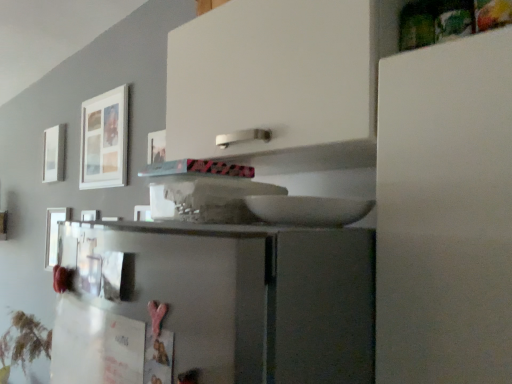
Image resolution: width=512 pixels, height=384 pixels. Find the location of `white matte picture frame at upper left, the third picture frame from the back`. white matte picture frame at upper left, the third picture frame from the back is located at coordinates [104, 139].

What are the coordinates of `picture frame on the left side of metallic silver picture frame at left, which is counted as the second picture frame, starting from the back` in the screenshot? It's located at (54, 153).

Does white matte picture frame at upper left, arranged as the 3th picture frame when viewed from the right, appear on the right side of metallic silver picture frame at left, the second picture frame positioned from the front?

In fact, white matte picture frame at upper left, arranged as the 3th picture frame when viewed from the right, is to the left of metallic silver picture frame at left, the second picture frame positioned from the front.

From a real-world perspective, is white matte picture frame at upper left, the first picture frame from the back, beneath metallic silver picture frame at left, which is counted as the second picture frame, starting from the back?

No, from a real-world perspective, white matte picture frame at upper left, the first picture frame from the back, is not beneath metallic silver picture frame at left, which is counted as the second picture frame, starting from the back.

Does white matte picture frame at upper left, the third picture frame from the front, turn towards metallic silver picture frame at left, which is counted as the second picture frame, starting from the back?

No, white matte picture frame at upper left, the third picture frame from the front, is not oriented towards metallic silver picture frame at left, which is counted as the second picture frame, starting from the back.

Is white matte picture frame at upper left, the first picture frame from the back, not close to white matte picture frame at upper left, which is counted as the 1th picture frame, starting from the right?

Answer: No, white matte picture frame at upper left, the first picture frame from the back, is not far away from white matte picture frame at upper left, which is counted as the 1th picture frame, starting from the right.

Between point (48, 135) and point (127, 129), which one is positioned behind?

The point (48, 135) is behind.

How many degrees apart are the facing directions of white matte picture frame at upper left, placed as the 1th picture frame when sorted from left to right, and white matte picture frame at upper left, the third picture frame from the back?

There is a 0.676-degree angle between the facing directions of white matte picture frame at upper left, placed as the 1th picture frame when sorted from left to right, and white matte picture frame at upper left, the third picture frame from the back.

Is white matte picture frame at upper left, the first picture frame from the back, behind white matte picture frame at upper left, which is the first picture frame from front to back?

Yes, white matte picture frame at upper left, the first picture frame from the back, is behind white matte picture frame at upper left, which is the first picture frame from front to back.

From the picture: Between white matte picture frame at upper left, the third picture frame from the back, and metallic silver picture frame at left, the second picture frame positioned from the front, which one is positioned in front?

white matte picture frame at upper left, the third picture frame from the back, is more forward.

I want to click on the 1st picture frame counting from the left of the white matte picture frame at upper left, the third picture frame from the back, so click(54, 234).

From a real-world perspective, between white matte picture frame at upper left, the third picture frame from the back, and metallic silver picture frame at left, the second picture frame positioned from the front, who is vertically lower?

metallic silver picture frame at left, the second picture frame positioned from the front, from a real-world perspective.

Which object is positioned more to the left, white matte picture frame at upper left, which is the first picture frame from front to back, or metallic silver picture frame at left, the second picture frame in the right-to-left sequence?

metallic silver picture frame at left, the second picture frame in the right-to-left sequence, is more to the left.

Considering the sizes of white matte picture frame at upper left, which is counted as the 1th picture frame, starting from the right, and white matte picture frame at upper left, placed as the 1th picture frame when sorted from left to right, in the image, is white matte picture frame at upper left, which is counted as the 1th picture frame, starting from the right, taller or shorter than white matte picture frame at upper left, placed as the 1th picture frame when sorted from left to right,?

Considering their sizes, white matte picture frame at upper left, which is counted as the 1th picture frame, starting from the right, has more height than white matte picture frame at upper left, placed as the 1th picture frame when sorted from left to right.

Can you confirm if white matte picture frame at upper left, which is counted as the 1th picture frame, starting from the right, is positioned to the left of white matte picture frame at upper left, the first picture frame from the back?

No, white matte picture frame at upper left, which is counted as the 1th picture frame, starting from the right, is not to the left of white matte picture frame at upper left, the first picture frame from the back.

Does white matte picture frame at upper left, which is the first picture frame from front to back, come behind white matte picture frame at upper left, the first picture frame from the back?

No.

From the image's perspective, between white matte picture frame at upper left, the third picture frame from the back, and white matte picture frame at upper left, the first picture frame from the back, which one is located above?

white matte picture frame at upper left, the third picture frame from the back.

Between metallic silver picture frame at left, the second picture frame in the right-to-left sequence, and white matte picture frame at upper left, which is counted as the 1th picture frame, starting from the right, which one has larger width?

Wider between the two is metallic silver picture frame at left, the second picture frame in the right-to-left sequence.

Is metallic silver picture frame at left, which is counted as the second picture frame, starting from the back, to the right of white matte picture frame at upper left, which is the first picture frame from front to back, from the viewer's perspective?

Incorrect, metallic silver picture frame at left, which is counted as the second picture frame, starting from the back, is not on the right side of white matte picture frame at upper left, which is the first picture frame from front to back.

In the scene shown: Would you say metallic silver picture frame at left, acting as the 2th picture frame starting from the left, is a long distance from white matte picture frame at upper left, which is the first picture frame from front to back?

That's not correct — metallic silver picture frame at left, acting as the 2th picture frame starting from the left, is a little close to white matte picture frame at upper left, which is the first picture frame from front to back.

Where is `picture frame that is the 2nd object located below the white matte picture frame at upper left, which is the third picture frame in left-to-right order (from the image's perspective)`? picture frame that is the 2nd object located below the white matte picture frame at upper left, which is the third picture frame in left-to-right order (from the image's perspective) is located at coordinates (54, 234).

Based on the photo, is metallic silver picture frame at left, the second picture frame positioned from the front, wider than white matte picture frame at upper left, the first picture frame from the back?

No.

Which is behind, metallic silver picture frame at left, the second picture frame in the right-to-left sequence, or white matte picture frame at upper left, placed as the 1th picture frame when sorted from left to right?

white matte picture frame at upper left, placed as the 1th picture frame when sorted from left to right, is further away from the camera.

Which of these two, metallic silver picture frame at left, the second picture frame positioned from the front, or white matte picture frame at upper left, the first picture frame from the back, is smaller?

metallic silver picture frame at left, the second picture frame positioned from the front.

Is metallic silver picture frame at left, the second picture frame in the right-to-left sequence, not inside white matte picture frame at upper left, placed as the 1th picture frame when sorted from left to right?

metallic silver picture frame at left, the second picture frame in the right-to-left sequence, is positioned outside white matte picture frame at upper left, placed as the 1th picture frame when sorted from left to right.

Identify the location of picture frame lying below the white matte picture frame at upper left, the third picture frame from the front (from the image's perspective). (54, 234).

Starting from the white matte picture frame at upper left, the first picture frame from the back, which picture frame is the 2nd one to the right? Please provide its 2D coordinates.

[(104, 139)]

Which object lies further to the anchor point white matte picture frame at upper left, which is the third picture frame in left-to-right order, white matte picture frame at upper left, the third picture frame from the front, or metallic silver picture frame at left, acting as the 2th picture frame starting from the left?

white matte picture frame at upper left, the third picture frame from the front, is positioned further to the anchor white matte picture frame at upper left, which is the third picture frame in left-to-right order.

Considering their positions, is white matte picture frame at upper left, which is the first picture frame from front to back, positioned further to metallic silver picture frame at left, the second picture frame positioned from the front, than white matte picture frame at upper left, placed as the 1th picture frame when sorted from left to right?

white matte picture frame at upper left, which is the first picture frame from front to back.

Looking at the image, which one is located closer to white matte picture frame at upper left, which is the third picture frame in left-to-right order, metallic silver picture frame at left, the second picture frame in the right-to-left sequence, or white matte picture frame at upper left, arranged as the 3th picture frame when viewed from the right?

metallic silver picture frame at left, the second picture frame in the right-to-left sequence, lies closer to white matte picture frame at upper left, which is the third picture frame in left-to-right order, than the other object.

Which object lies nearer to the anchor point metallic silver picture frame at left, acting as the 2th picture frame starting from the left, white matte picture frame at upper left, the first picture frame from the back, or white matte picture frame at upper left, the third picture frame from the back?

The object closer to metallic silver picture frame at left, acting as the 2th picture frame starting from the left, is white matte picture frame at upper left, the first picture frame from the back.

Based on their spatial positions, is white matte picture frame at upper left, which is counted as the 1th picture frame, starting from the right, or metallic silver picture frame at left, the second picture frame in the right-to-left sequence, closer to white matte picture frame at upper left, placed as the 1th picture frame when sorted from left to right?

Among the two, metallic silver picture frame at left, the second picture frame in the right-to-left sequence, is located nearer to white matte picture frame at upper left, placed as the 1th picture frame when sorted from left to right.

Based on their spatial positions, is metallic silver picture frame at left, acting as the 2th picture frame starting from the left, or white matte picture frame at upper left, the third picture frame from the back, further from white matte picture frame at upper left, the first picture frame from the back?

Based on the image, white matte picture frame at upper left, the third picture frame from the back, appears to be further to white matte picture frame at upper left, the first picture frame from the back.

The width and height of the screenshot is (512, 384). Find the location of `picture frame between white matte picture frame at upper left, the third picture frame from the back, and metallic silver picture frame at left, the second picture frame in the right-to-left sequence, in the up-down direction`. picture frame between white matte picture frame at upper left, the third picture frame from the back, and metallic silver picture frame at left, the second picture frame in the right-to-left sequence, in the up-down direction is located at coordinates (54, 153).